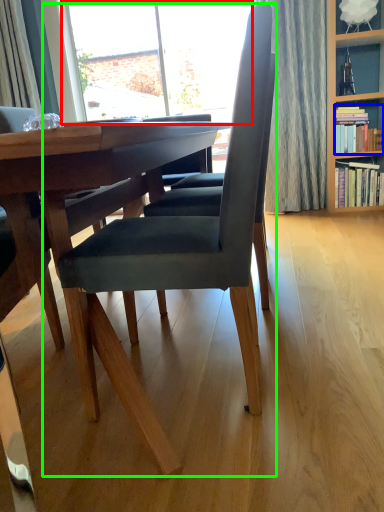
Question: Based on their relative distances, which object is farther from window (highlighted by a red box)? Choose from book (highlighted by a blue box) and chair (highlighted by a green box).

Choices:
 (A) book
 (B) chair

Answer: (B)